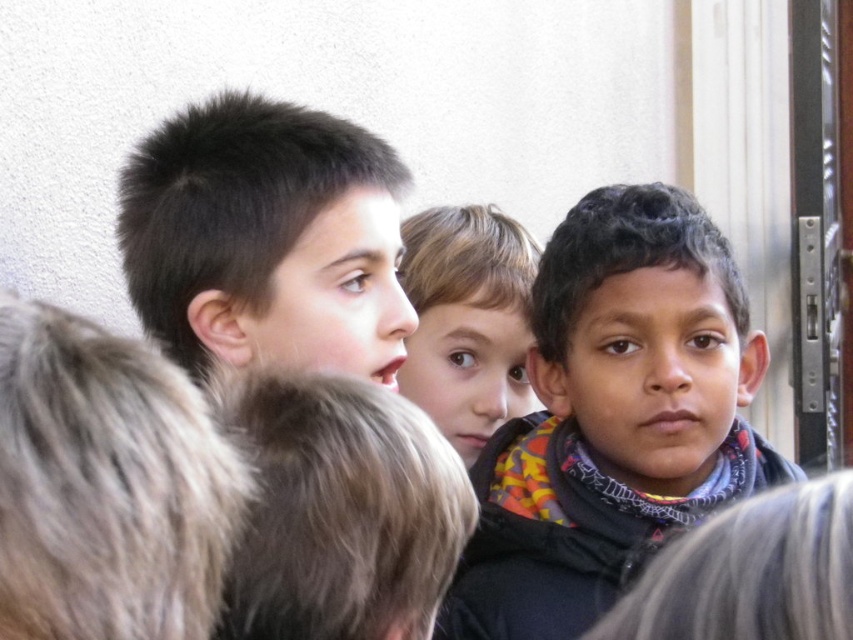
You are taking a photo of the three boys in the scene. You want to focus on the point closer to the camera. Which point should you choose between point (657, 328) and point (334, 147)?

Point (657, 328) is further to the camera than point (334, 147), so you should choose point (657, 328) to focus on the point closer to the camera.